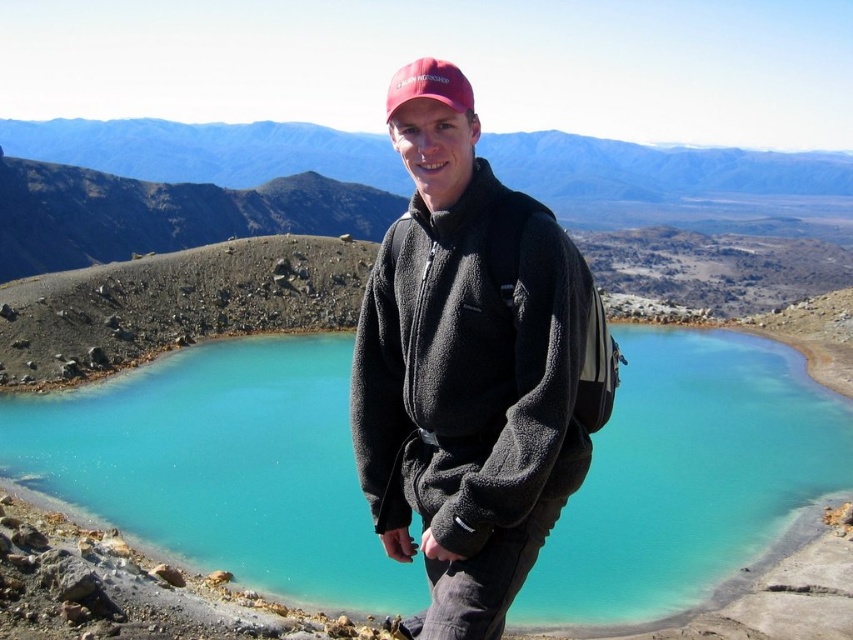
Is black fleece jacket at center bigger than matte red baseball cap at upper center?

Indeed, black fleece jacket at center has a larger size compared to matte red baseball cap at upper center.

Between black fleece jacket at center and matte red baseball cap at upper center, which one has more height?

Standing taller between the two is black fleece jacket at center.

Is point (521, 500) positioned after point (447, 83)?

No, it is not.

This screenshot has height=640, width=853. Find the location of `black fleece jacket at center`. black fleece jacket at center is located at coordinates (468, 376).

Can you confirm if turquoise glossy water at center is positioned above matte red baseball cap at upper center?

Actually, turquoise glossy water at center is below matte red baseball cap at upper center.

Does turquoise glossy water at center appear under matte red baseball cap at upper center?

Yes.

Where is `turquoise glossy water at center`? Image resolution: width=853 pixels, height=640 pixels. turquoise glossy water at center is located at coordinates [222, 465].

The height and width of the screenshot is (640, 853). What are the coordinates of `turquoise glossy water at center` in the screenshot? It's located at (222, 465).

Is turquoise glossy water at center closer to the viewer compared to black fleece jacket at center?

No, it is behind black fleece jacket at center.

Is turquoise glossy water at center above black fleece jacket at center?

Yes, turquoise glossy water at center is above black fleece jacket at center.

Find the location of a particular element. The width and height of the screenshot is (853, 640). turquoise glossy water at center is located at coordinates (222, 465).

Locate an element on the screen. turquoise glossy water at center is located at coordinates (222, 465).